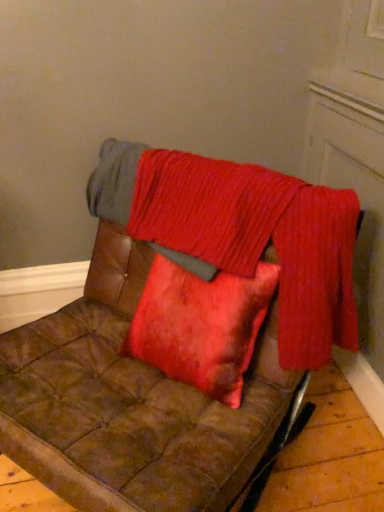
Question: Should I look upward or downward to see crinkled red fabric at upper center?

Choices:
 (A) up
 (B) down

Answer: (A)

Question: From a real-world perspective, is brown leather chair at center on crinkled red fabric at upper center?

Choices:
 (A) yes
 (B) no

Answer: (B)

Question: From the image's perspective, does brown leather chair at center appear lower than crinkled red fabric at upper center?

Choices:
 (A) yes
 (B) no

Answer: (A)

Question: Does brown leather chair at center have a lesser height compared to crinkled red fabric at upper center?

Choices:
 (A) yes
 (B) no

Answer: (B)

Question: Is brown leather chair at center positioned far away from crinkled red fabric at upper center?

Choices:
 (A) no
 (B) yes

Answer: (A)

Question: From a real-world perspective, is brown leather chair at center positioned under crinkled red fabric at upper center based on gravity?

Choices:
 (A) no
 (B) yes

Answer: (B)

Question: Considering the relative sizes of brown leather chair at center and crinkled red fabric at upper center in the image provided, is brown leather chair at center bigger than crinkled red fabric at upper center?

Choices:
 (A) no
 (B) yes

Answer: (B)

Question: Does crinkled red fabric at upper center have a lesser height compared to brown leather chair at center?

Choices:
 (A) yes
 (B) no

Answer: (A)

Question: Is crinkled red fabric at upper center completely or partially outside of brown leather chair at center?

Choices:
 (A) yes
 (B) no

Answer: (B)

Question: Is crinkled red fabric at upper center further to the viewer compared to brown leather chair at center?

Choices:
 (A) yes
 (B) no

Answer: (A)

Question: Is crinkled red fabric at upper center positioned far away from brown leather chair at center?

Choices:
 (A) no
 (B) yes

Answer: (A)

Question: From the image's perspective, is crinkled red fabric at upper center on brown leather chair at center?

Choices:
 (A) no
 (B) yes

Answer: (B)

Question: From a real-world perspective, is crinkled red fabric at upper center physically above brown leather chair at center?

Choices:
 (A) yes
 (B) no

Answer: (A)

Question: Looking at their shapes, would you say crinkled red fabric at upper center is wider or thinner than brown leather chair at center?

Choices:
 (A) thin
 (B) wide

Answer: (A)